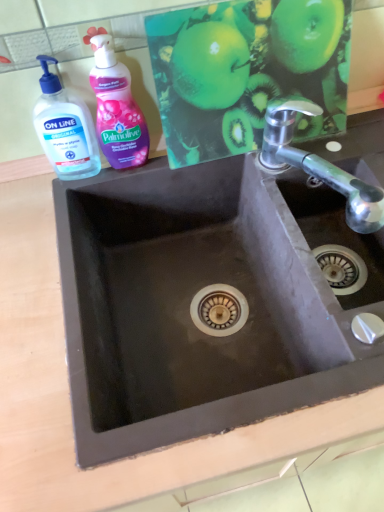
The image size is (384, 512). I want to click on free space in front of transparent plastic hand soap at upper left, so click(45, 238).